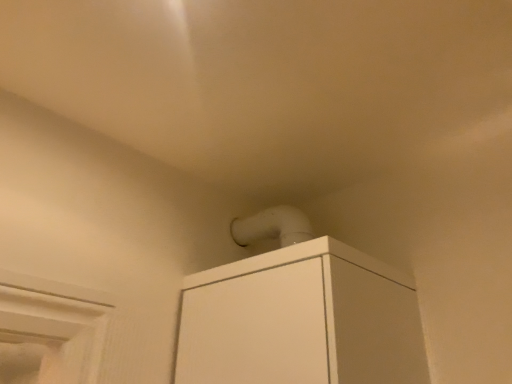
Find the location of a particular element. Image resolution: width=512 pixels, height=384 pixels. white matte cabinet at upper center is located at coordinates (300, 320).

This screenshot has height=384, width=512. What do you see at coordinates (300, 320) in the screenshot? I see `white matte cabinet at upper center` at bounding box center [300, 320].

Where is `white matte cabinet at upper center`? This screenshot has width=512, height=384. white matte cabinet at upper center is located at coordinates (300, 320).